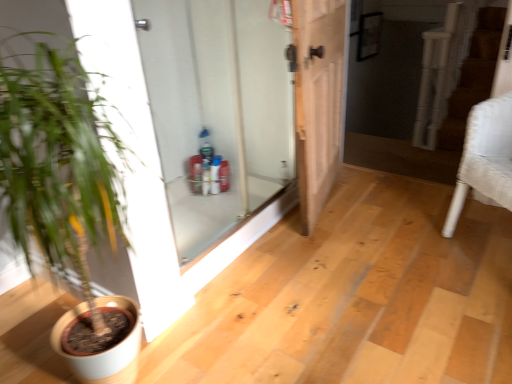
Question: Is white glass door at center, acting as the first door starting from the left, closer to camera compared to white textured armchair at right?

Choices:
 (A) no
 (B) yes

Answer: (B)

Question: From the image's perspective, does white glass door at center, the second door viewed from the right, appear higher than white textured armchair at right?

Choices:
 (A) no
 (B) yes

Answer: (B)

Question: Is white glass door at center, the second door viewed from the right, taller than white textured armchair at right?

Choices:
 (A) yes
 (B) no

Answer: (A)

Question: Can you confirm if white glass door at center, the second door viewed from the right, is shorter than white textured armchair at right?

Choices:
 (A) no
 (B) yes

Answer: (A)

Question: From a real-world perspective, is white glass door at center, acting as the first door starting from the left, over white textured armchair at right?

Choices:
 (A) no
 (B) yes

Answer: (B)

Question: Is white textured armchair at right inside white glass door at center, acting as the first door starting from the left?

Choices:
 (A) yes
 (B) no

Answer: (B)

Question: Considering the relative positions of white glass door at center, the second door viewed from the right, and white matte pot at left in the image provided, is white glass door at center, the second door viewed from the right, in front of white matte pot at left?

Choices:
 (A) no
 (B) yes

Answer: (A)

Question: Is white glass door at center, acting as the first door starting from the left, surrounding white matte pot at left?

Choices:
 (A) yes
 (B) no

Answer: (B)

Question: Is white glass door at center, the second door viewed from the right, not inside white matte pot at left?

Choices:
 (A) yes
 (B) no

Answer: (A)

Question: Is white glass door at center, the second door viewed from the right, thinner than white matte pot at left?

Choices:
 (A) no
 (B) yes

Answer: (B)

Question: Is white glass door at center, acting as the first door starting from the left, next to white matte pot at left and touching it?

Choices:
 (A) yes
 (B) no

Answer: (B)

Question: Does white glass door at center, acting as the first door starting from the left, have a larger size compared to white matte pot at left?

Choices:
 (A) yes
 (B) no

Answer: (B)

Question: Does white textured armchair at right appear on the right side of white matte pot at left?

Choices:
 (A) no
 (B) yes

Answer: (B)